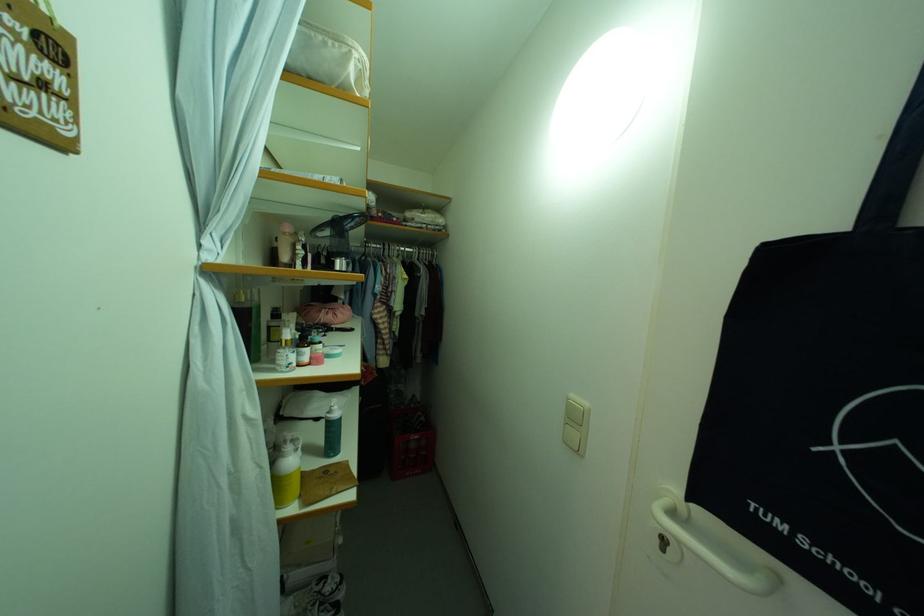
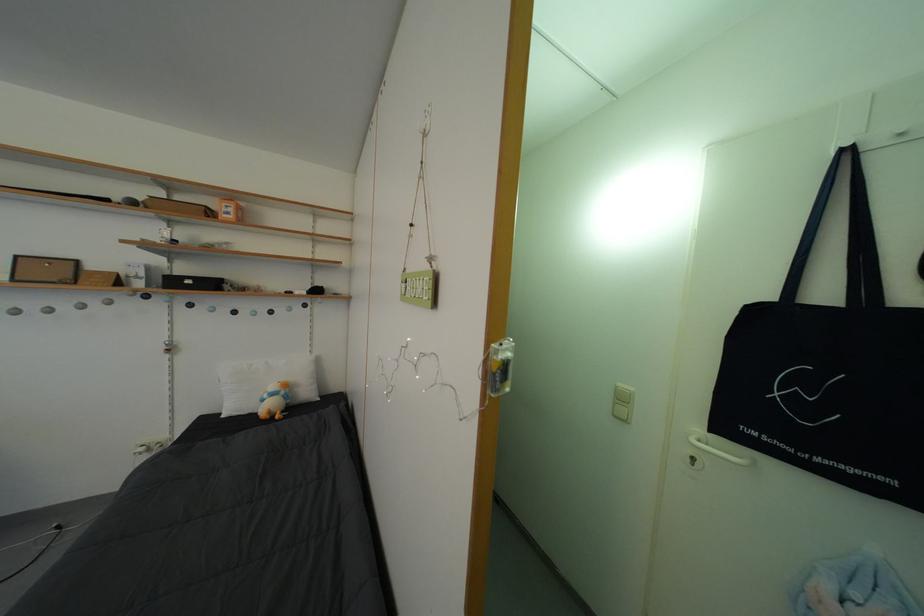
What movement of the cameraman would produce the second image?

The cameraman walked toward left, backward.